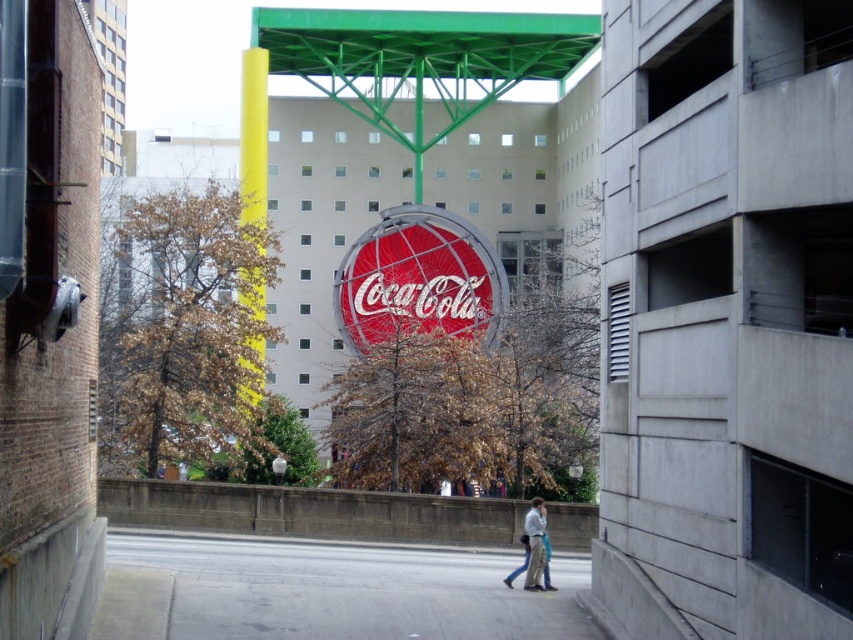
Question: Is gray concrete pavement at center closer to the viewer compared to light blue jeans at center?

Choices:
 (A) no
 (B) yes

Answer: (B)

Question: Which of the following is the closest to the observer?

Choices:
 (A) light blue jeans at center
 (B) smooth white lamp post at center

Answer: (A)

Question: Does gray concrete pavement at center lie behind light blue jeans at center?

Choices:
 (A) no
 (B) yes

Answer: (A)

Question: Among these points, which one is nearest to the camera?

Choices:
 (A) (544, 522)
 (B) (277, 483)

Answer: (A)

Question: Which object appears farthest from the camera in this image?

Choices:
 (A) smooth white lamp post at center
 (B) light blue jeans at center
 (C) gray concrete pavement at center

Answer: (A)

Question: Can you confirm if gray concrete pavement at center is smaller than light blue jeans at center?

Choices:
 (A) yes
 (B) no

Answer: (B)